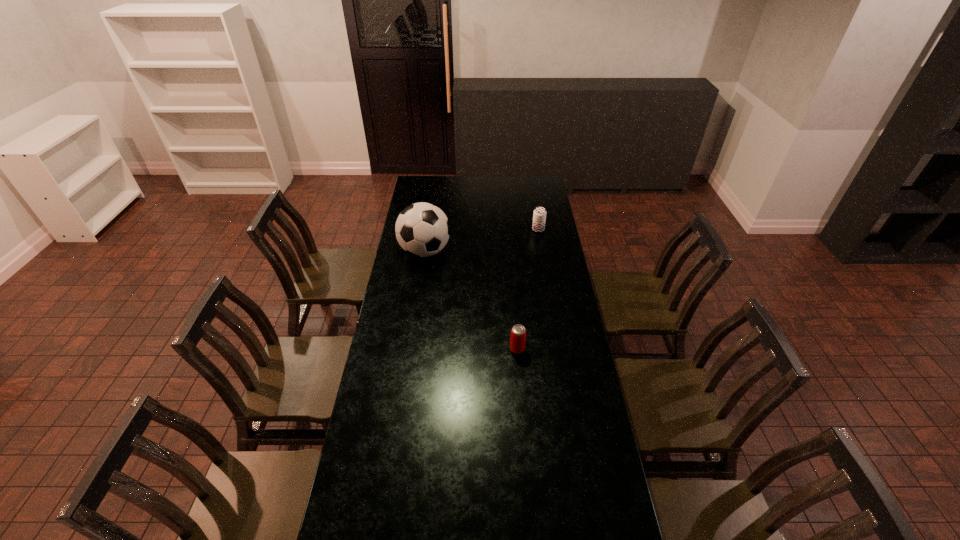
Identify the location of object located at the right edge. This screenshot has height=540, width=960. (539, 216).

Identify the location of vacant space at the far edge. (445, 176).

Image resolution: width=960 pixels, height=540 pixels. What are the coordinates of `vacant region at the left edge of the desktop` in the screenshot? It's located at (376, 536).

In order to click on free space at the right edge of the desktop in this screenshot , I will do `click(584, 350)`.

The height and width of the screenshot is (540, 960). In order to click on vacant region at the far right corner of the desktop in this screenshot , I will do `click(546, 185)`.

Locate an element on the screen. The image size is (960, 540). vacant region between the leftmost object and the farther beer can is located at coordinates (482, 240).

Where is `free spot between the nearer beer can and the farthest object`? free spot between the nearer beer can and the farthest object is located at coordinates (528, 289).

I want to click on empty space that is in between the leftmost object and the farther beer can, so click(482, 240).

Image resolution: width=960 pixels, height=540 pixels. I want to click on unoccupied position between the farther beer can and the leftmost object, so [482, 240].

In order to click on vacant point located between the leftmost object and the nearer beer can in this screenshot , I will do `click(471, 300)`.